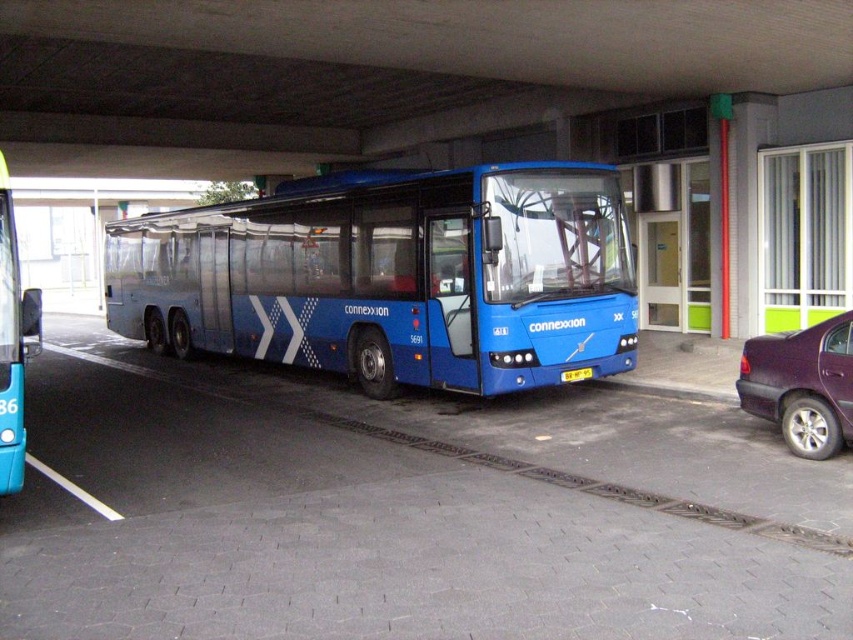
Does blue metallic bus at center have a lesser height compared to metallic purple sedan at right?

Incorrect, blue metallic bus at center's height does not fall short of metallic purple sedan at right's.

Between blue metallic bus at center and metallic purple sedan at right, which one appears on the left side from the viewer's perspective?

blue metallic bus at center

Identify the location of blue metallic bus at center. (392, 276).

Between metallic purple sedan at right and blue metallic bus at left, which one appears on the left side from the viewer's perspective?

From the viewer's perspective, blue metallic bus at left appears more on the left side.

Which is in front, point (811, 358) or point (3, 433)?

Point (3, 433) is in front.

The image size is (853, 640). Identify the location of metallic purple sedan at right. (802, 385).

Who is positioned more to the left, blue metallic bus at center or yellow plastic license plate at center?

Positioned to the left is blue metallic bus at center.

What are the coordinates of `blue metallic bus at center` in the screenshot? It's located at (392, 276).

Where is `blue metallic bus at center`? blue metallic bus at center is located at coordinates (392, 276).